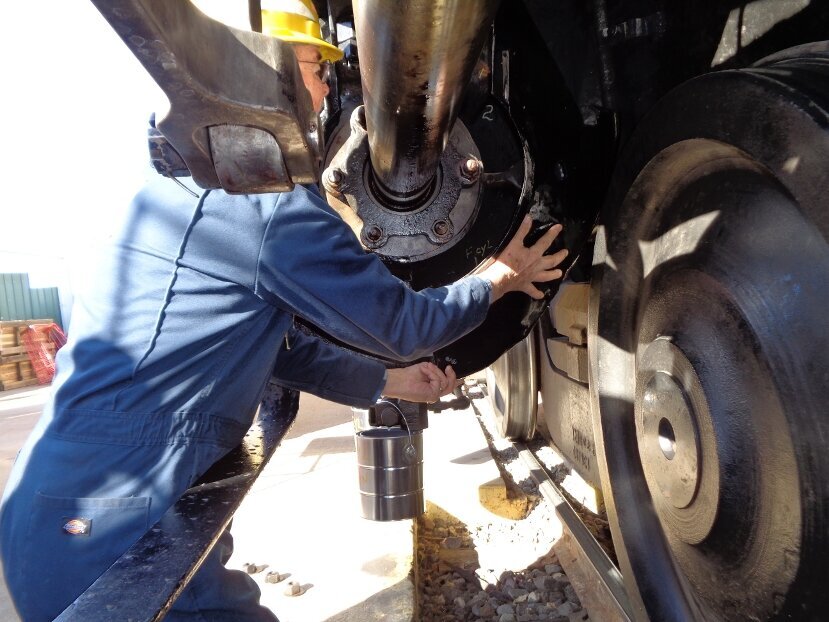
Locate an element on the screen. This screenshot has height=622, width=829. bucket is located at coordinates (410, 481).